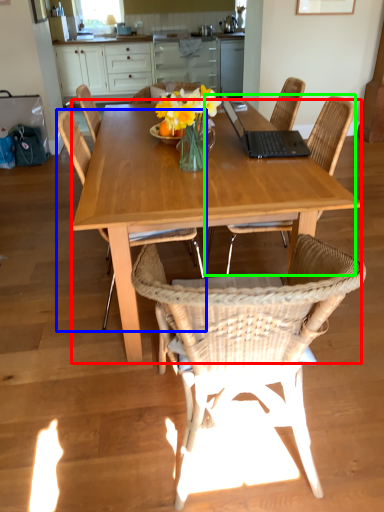
Question: Which object is the closest to the kitchen & dining room table (highlighted by a red box)? Choose among these: chair (highlighted by a blue box) or chair (highlighted by a green box).

Choices:
 (A) chair
 (B) chair

Answer: (A)